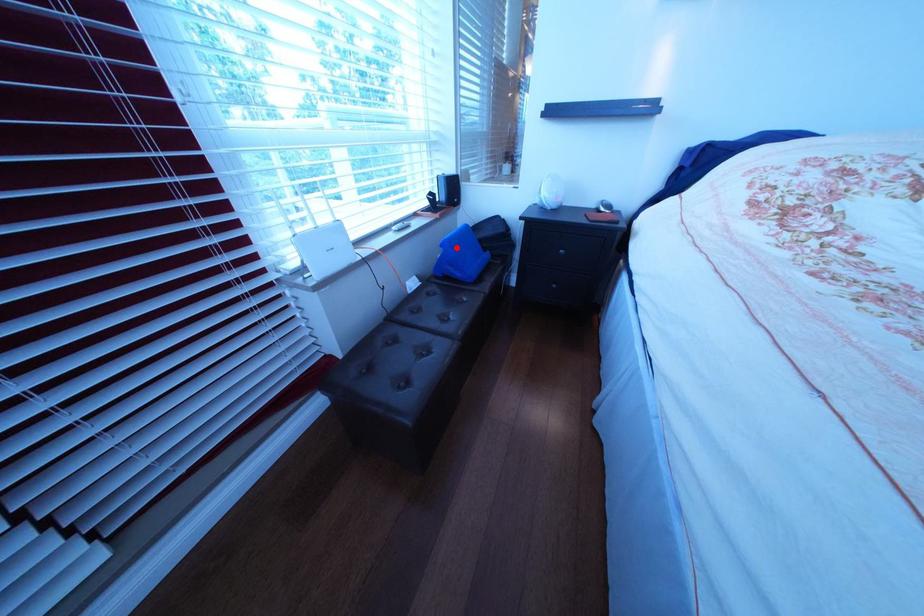
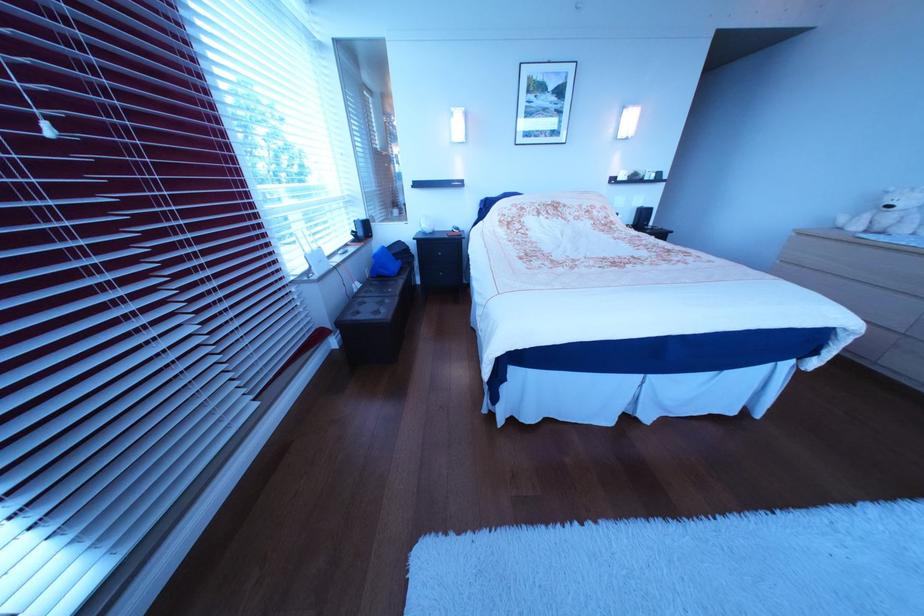
Question: I am providing you with two images of the same scene from different viewpoints. A red point is marked on the first image. At the location where the point appears in image 1, is it still visible in image 2?

Choices:
 (A) Yes
 (B) No

Answer: (A)